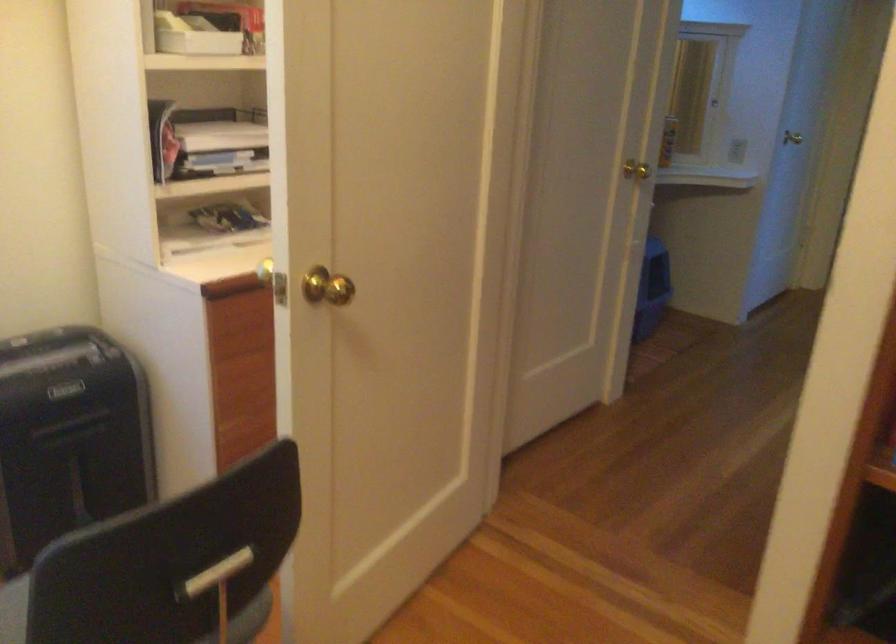
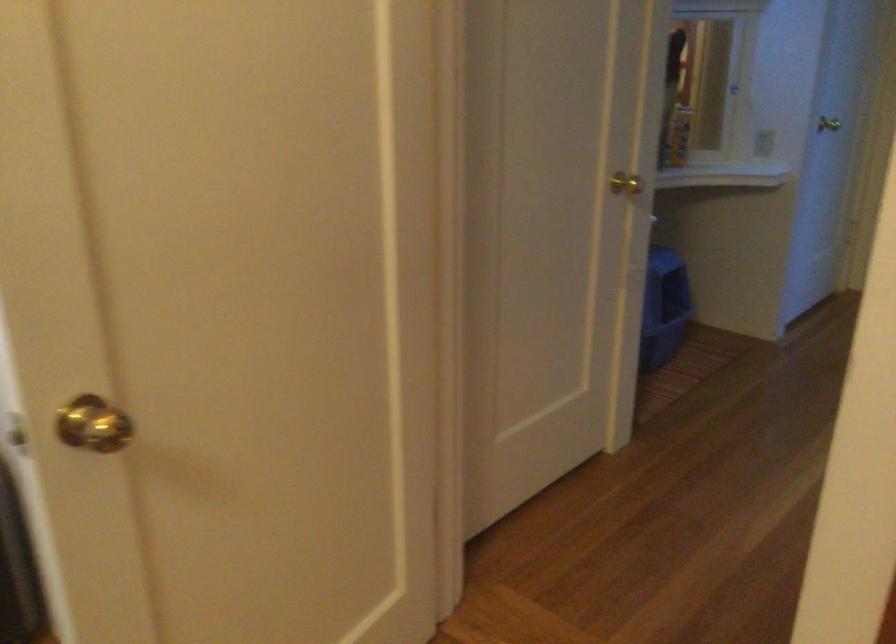
Question: The images are taken continuously from a first-person perspective. In which direction is your viewpoint rotating?

Choices:
 (A) Left
 (B) Right
 (C) Up
 (D) Down

Answer: (A)